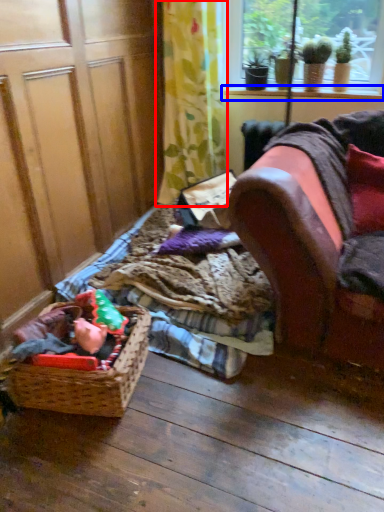
Question: Which of the following is the farthest to the observer, curtain (highlighted by a red box) or window sill (highlighted by a blue box)?

Choices:
 (A) curtain
 (B) window sill

Answer: (B)